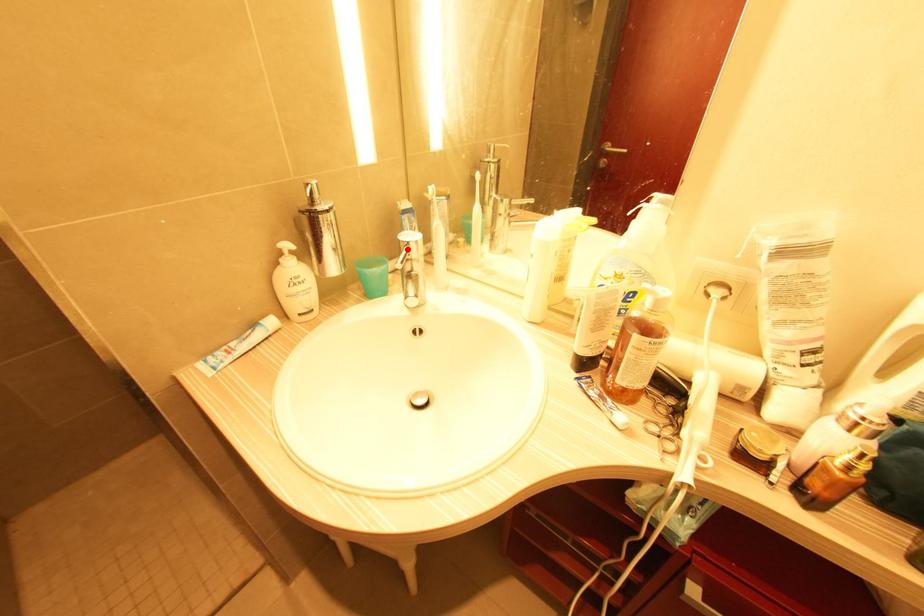
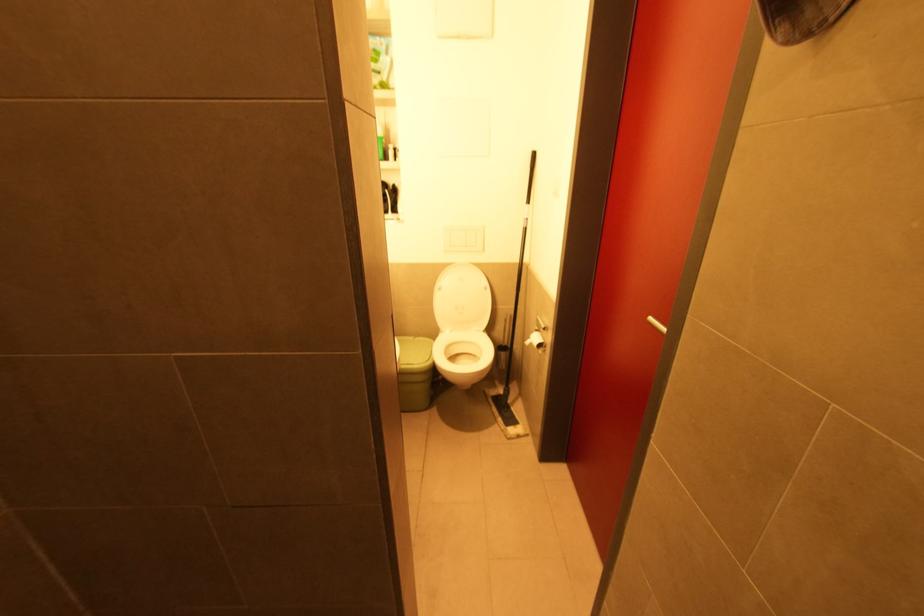
Question: I am providing you with two images of the same scene from different viewpoints. A red point is marked on the first image. Can you still see the location of the red point in image 2?

Choices:
 (A) Yes
 (B) No

Answer: (B)